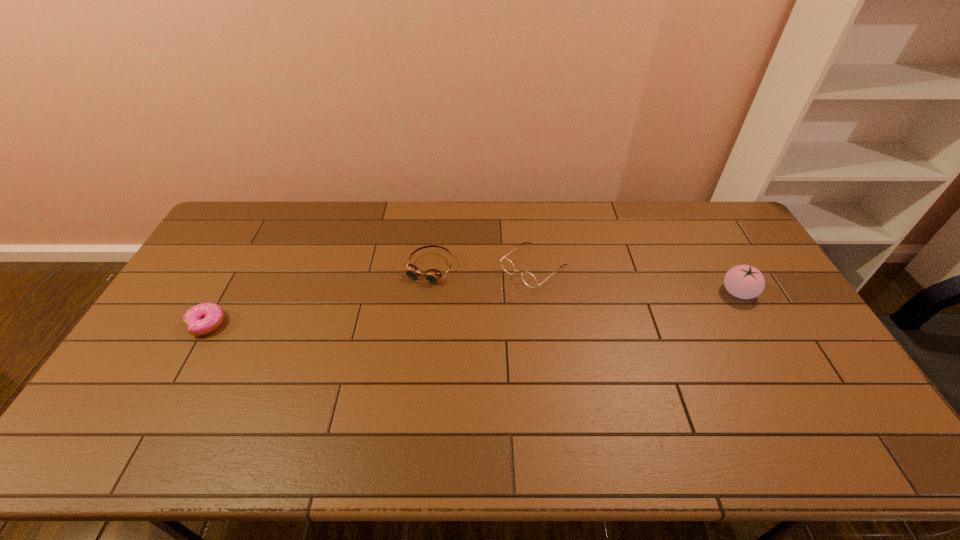
Where is `vacant space on the desktop that is between the nearest object and the rightmost object and is positioned on the front-facing side of the spectacles`? The image size is (960, 540). vacant space on the desktop that is between the nearest object and the rightmost object and is positioned on the front-facing side of the spectacles is located at coordinates 483,307.

I want to click on free spot on the desktop that is between the nearest object and the rightmost object and is positioned through the lenses of the goggles, so click(405, 312).